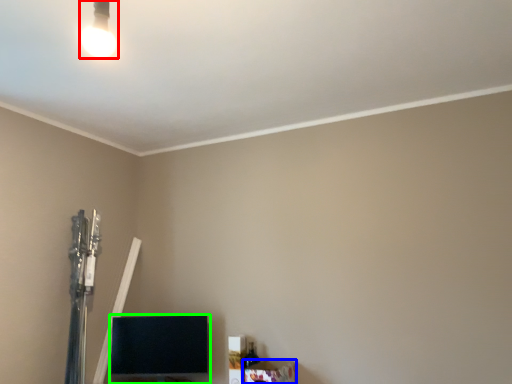
Question: Which object is the closest to the lamp (highlighted by a red box)? Choose among these: furniture (highlighted by a blue box) or furniture (highlighted by a green box).

Choices:
 (A) furniture
 (B) furniture

Answer: (B)